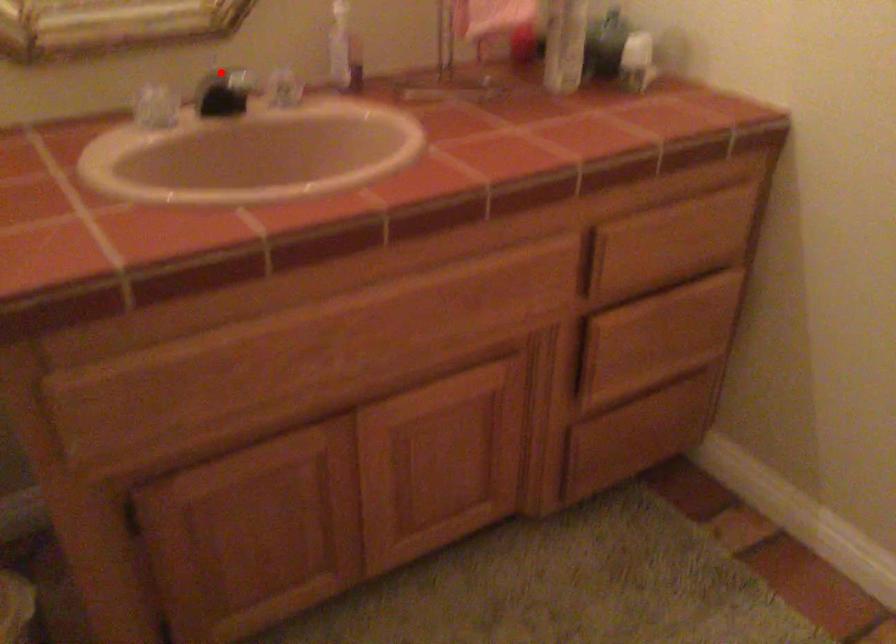
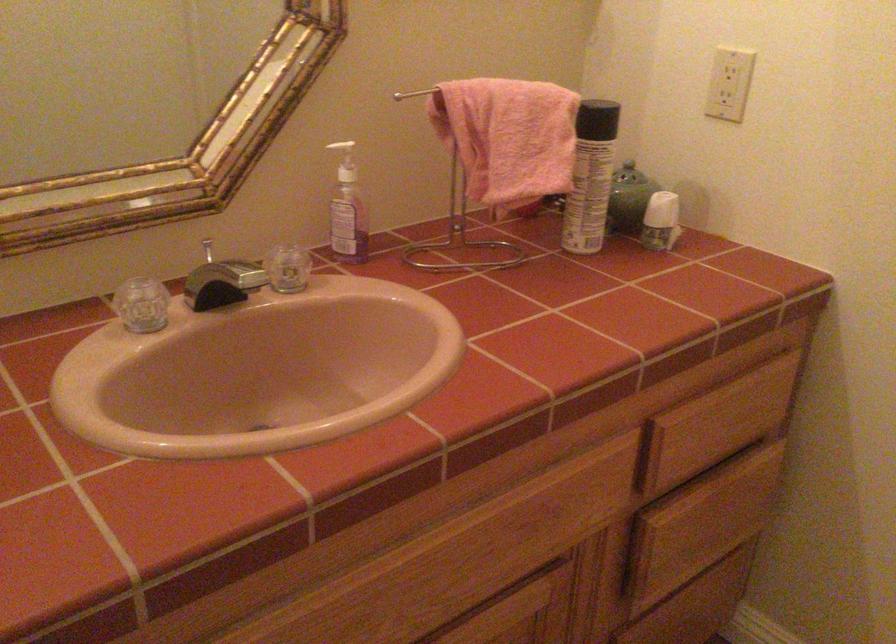
Locate, in the second image, the point that corresponds to the highlighted location in the first image.

(208, 250)